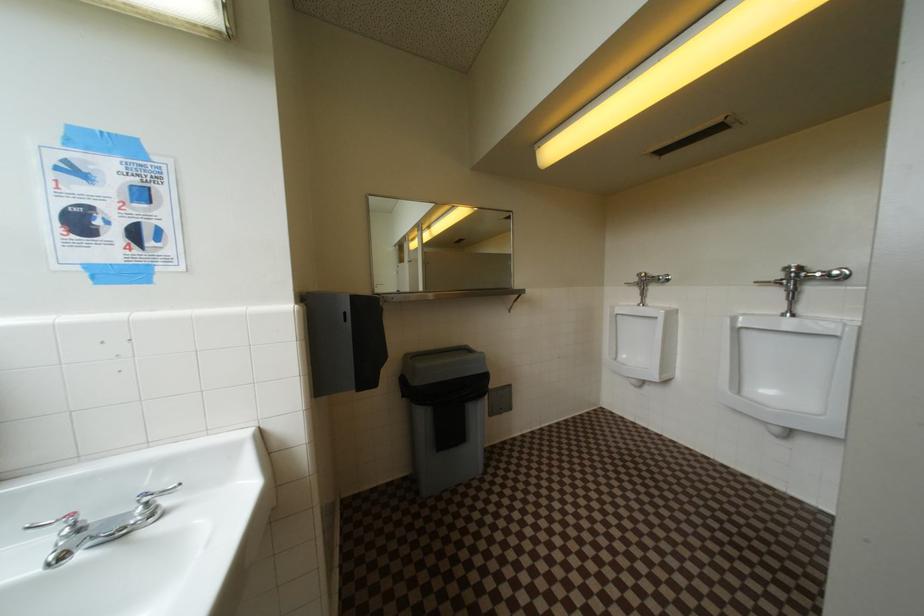
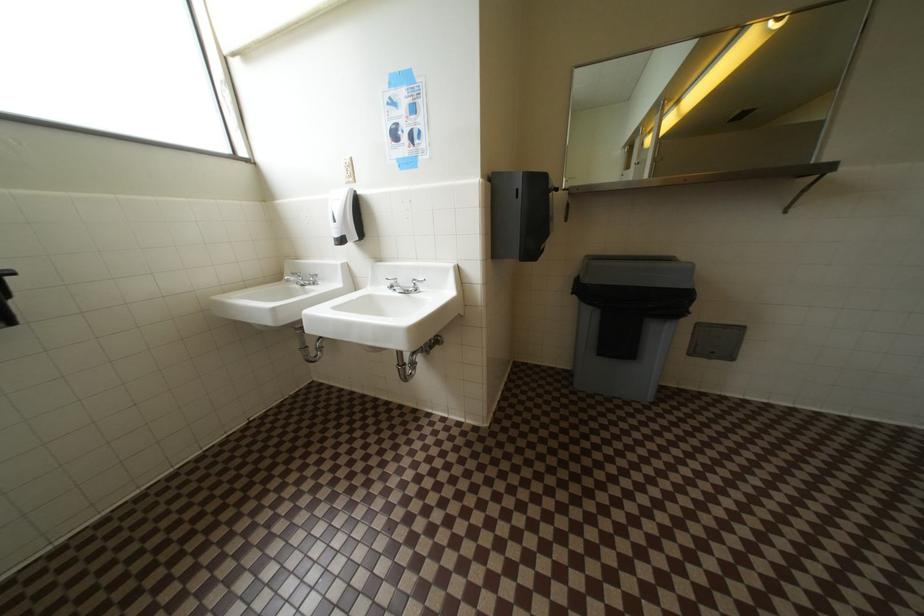
First-person continuous shooting, in which direction is the camera rotating?

The rotation direction of the camera is left-down.